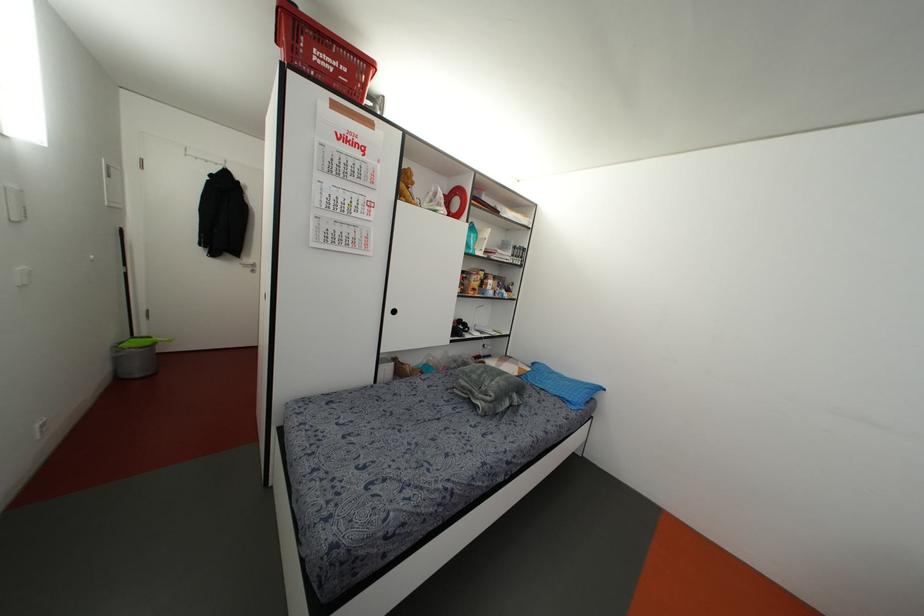
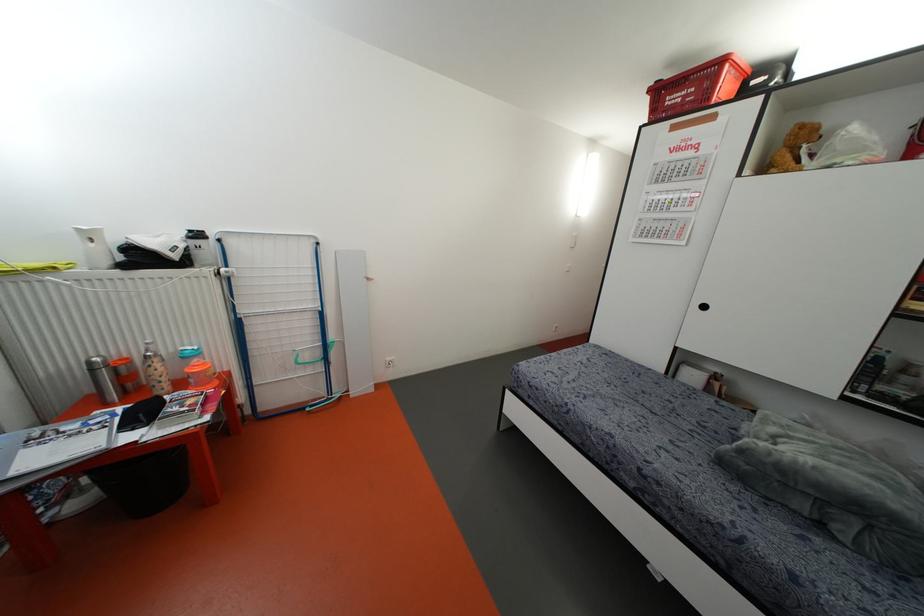
Question: I am providing you with two images of the same scene from different viewpoints. After the viewpoint changes to image2, which objects are now occluded?

Choices:
 (A) black cabinet handle
 (B) red plastic crate
 (C) patterned water bottle
 (D) none of these

Answer: (D)